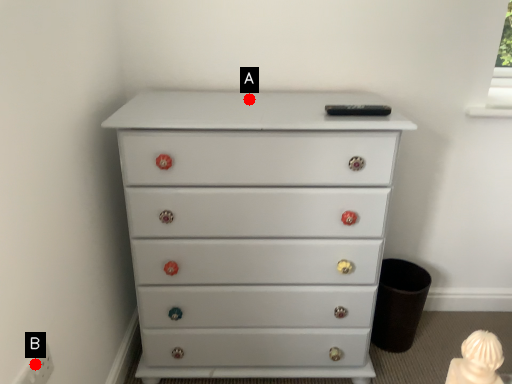
Question: Two points are circled on the image, labeled by A and B beside each circle. Among these points, which one is farthest from the camera?

Choices:
 (A) A is further
 (B) B is further

Answer: (A)